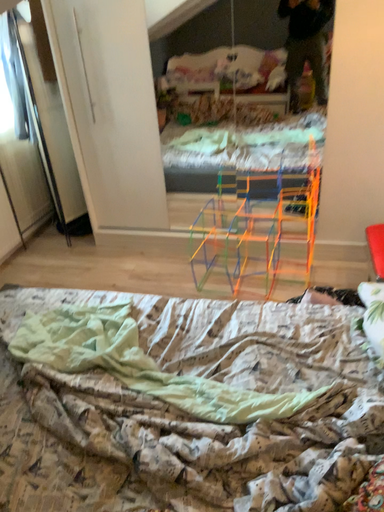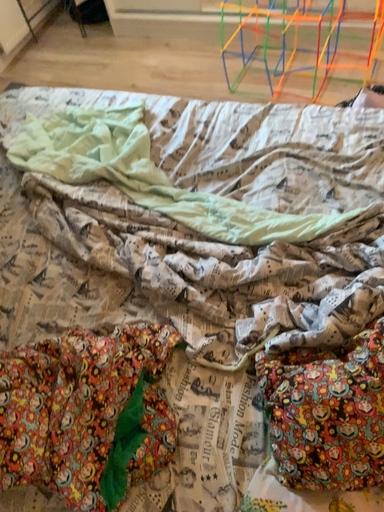
Question: Which way did the camera rotate in the video?

Choices:
 (A) rotated right
 (B) rotated left

Answer: (B)